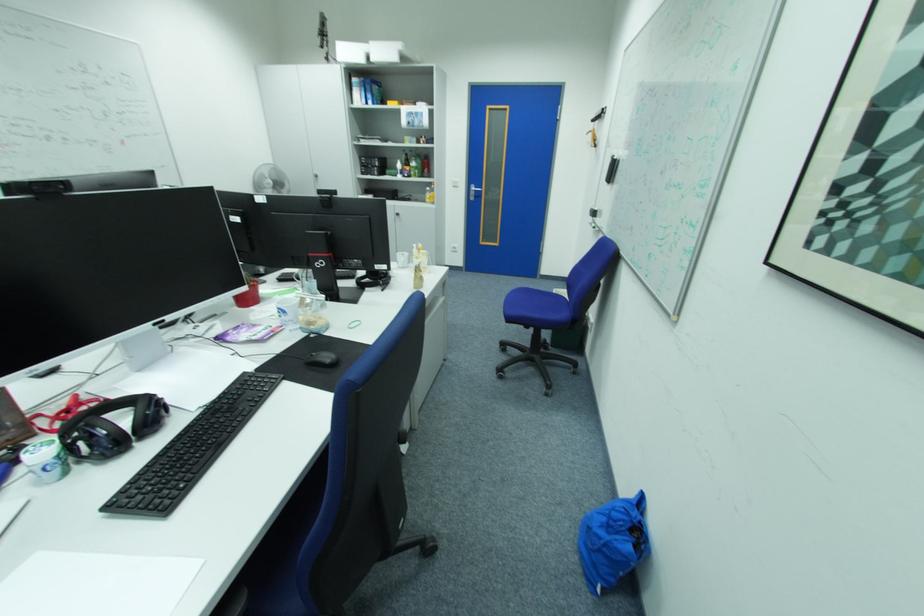
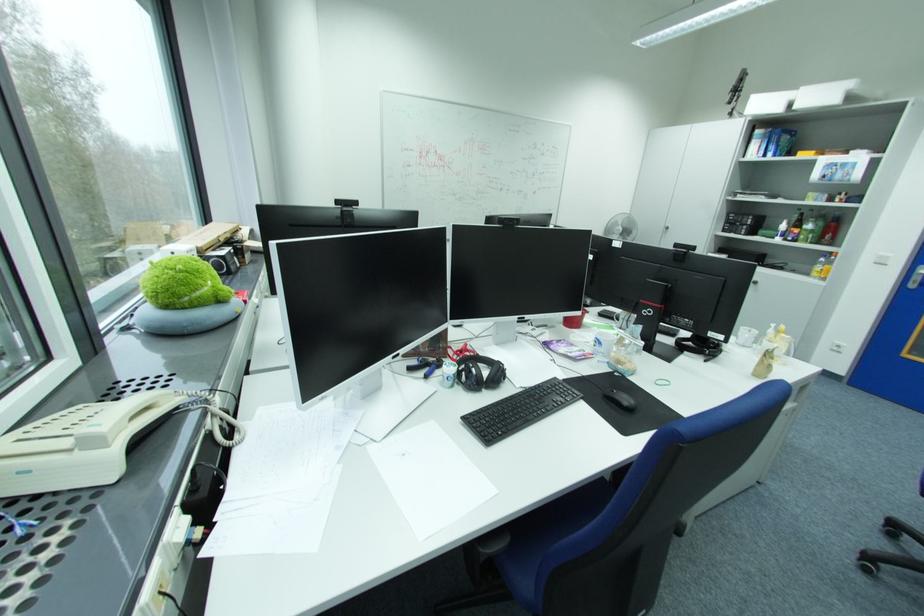
Where in the second image is the point corresponding to [436,190] from the first image?

(832, 260)